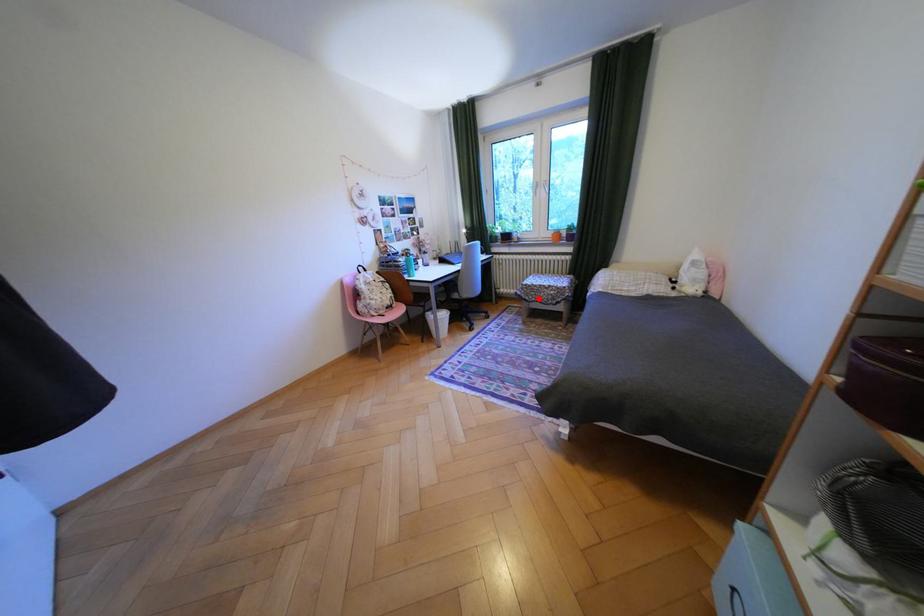
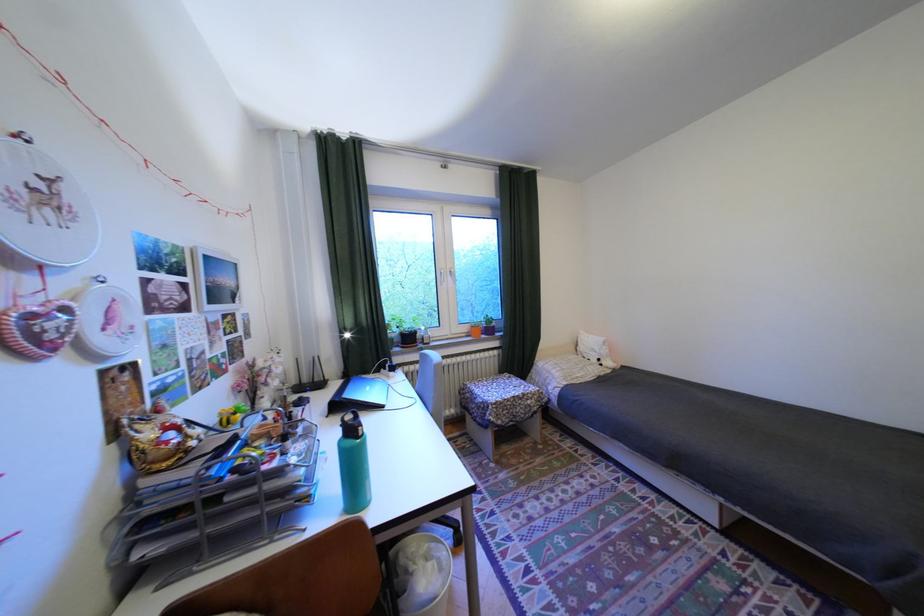
Where in the second image is the point corresponding to the highlighted location from the first image?

(512, 422)